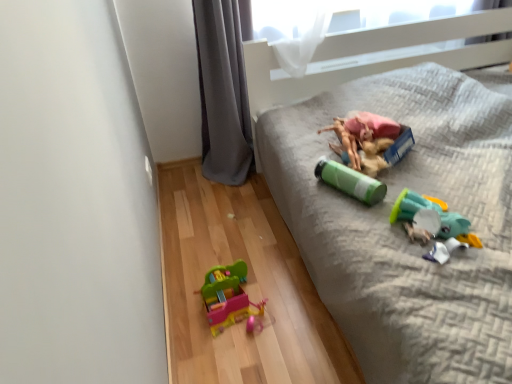
Where is `free point in front of multicolored plastic toy at lower center, the 4th toy positioned from the top`? free point in front of multicolored plastic toy at lower center, the 4th toy positioned from the top is located at coordinates (244, 359).